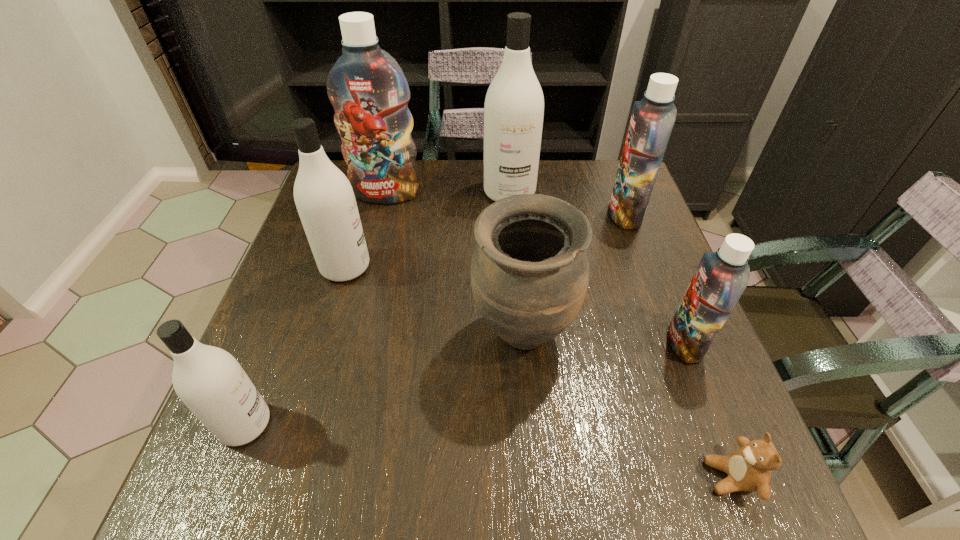
Locate an element on the screen. object situated at the near right corner is located at coordinates (749, 468).

Where is `free spot at the far edge of the desktop`? The image size is (960, 540). free spot at the far edge of the desktop is located at coordinates (564, 186).

Locate an element on the screen. The image size is (960, 540). vacant space at the left edge is located at coordinates (292, 275).

I want to click on free space at the right edge of the desktop, so click(669, 305).

At what (x,y) coordinates should I click in order to perform the action: click on vacant space at the far right corner. Please return your answer as a coordinate pair (x, y). The image size is (960, 540). Looking at the image, I should click on (599, 193).

At what (x,y) coordinates should I click in order to perform the action: click on free space between the shortest object and the urn. Please return your answer as a coordinate pair (x, y). The height and width of the screenshot is (540, 960). Looking at the image, I should click on (627, 406).

This screenshot has width=960, height=540. In order to click on free space that is in between the rightmost white shampoo and the fifth farthest shampoo in this screenshot , I will do `click(597, 268)`.

Locate an element on the screen. Image resolution: width=960 pixels, height=540 pixels. blank region between the leftmost blue shampoo and the teddy bear is located at coordinates (559, 335).

Where is `free space between the teddy bear and the third nearest shampoo`? This screenshot has height=540, width=960. free space between the teddy bear and the third nearest shampoo is located at coordinates (538, 372).

Where is `free space between the leftmost blue shampoo and the shortest object`? free space between the leftmost blue shampoo and the shortest object is located at coordinates (559, 335).